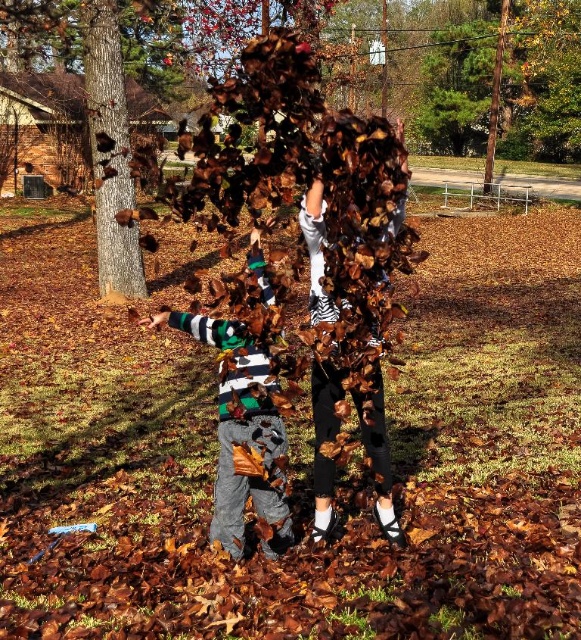
Question: Can you confirm if striped cotton shirt at left is thinner than smooth brown bark at left?

Choices:
 (A) yes
 (B) no

Answer: (A)

Question: Does striped cotton shirt at left appear under smooth brown bark at left?

Choices:
 (A) yes
 (B) no

Answer: (A)

Question: Does striped cotton shirt at left have a lesser width compared to smooth brown bark at left?

Choices:
 (A) no
 (B) yes

Answer: (B)